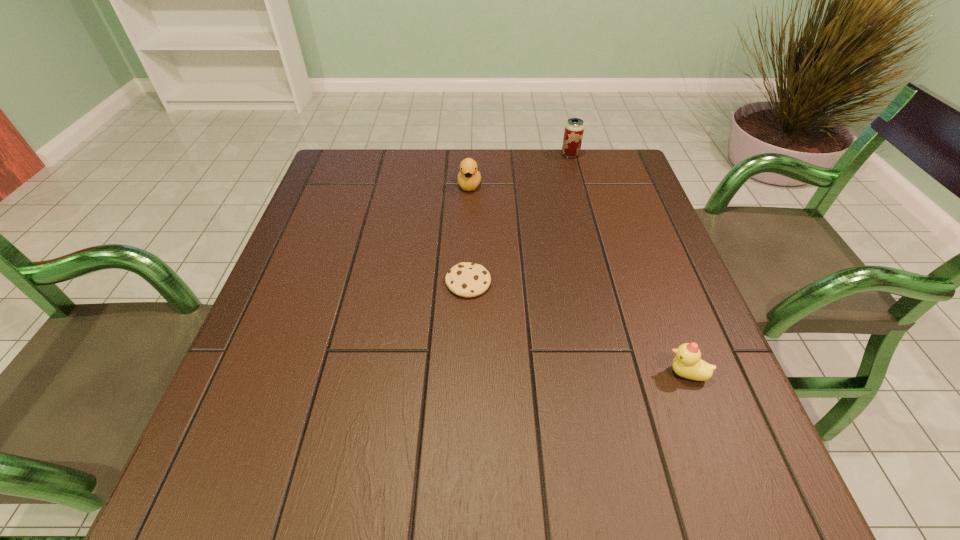
Locate an element on the screen. This screenshot has width=960, height=540. blank area at the near edge is located at coordinates (405, 490).

Locate an element on the screen. blank space at the left edge is located at coordinates (326, 327).

Image resolution: width=960 pixels, height=540 pixels. In order to click on vacant space at the right edge of the desktop in this screenshot , I will do `click(711, 358)`.

Identify the location of vacant space at the far left corner. This screenshot has width=960, height=540. (323, 194).

The width and height of the screenshot is (960, 540). What are the coordinates of `free spot at the near left corner of the desktop` in the screenshot? It's located at (219, 468).

This screenshot has height=540, width=960. In order to click on vacant area that lies between the tallest object and the nearest object in this screenshot , I will do `click(628, 264)`.

The width and height of the screenshot is (960, 540). I want to click on free space between the right duckling and the cookie, so pyautogui.click(x=577, y=328).

At what (x,y) coordinates should I click in order to perform the action: click on free spot between the farther duckling and the second nearest object. Please return your answer as a coordinate pair (x, y). Looking at the image, I should click on (468, 234).

At what (x,y) coordinates should I click in order to perform the action: click on free space between the second farthest object and the nearer duckling. Please return your answer as a coordinate pair (x, y). This screenshot has width=960, height=540. Looking at the image, I should click on (578, 279).

Image resolution: width=960 pixels, height=540 pixels. I want to click on free space between the second farthest object and the rightmost object, so click(578, 279).